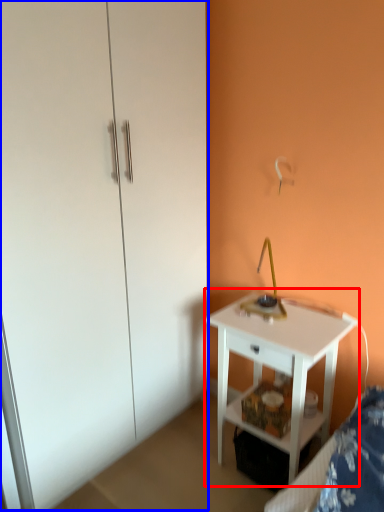
Question: Which object appears farthest to the camera in this image, nightstand (highlighted by a red box) or dresser (highlighted by a blue box)?

Choices:
 (A) nightstand
 (B) dresser

Answer: (A)